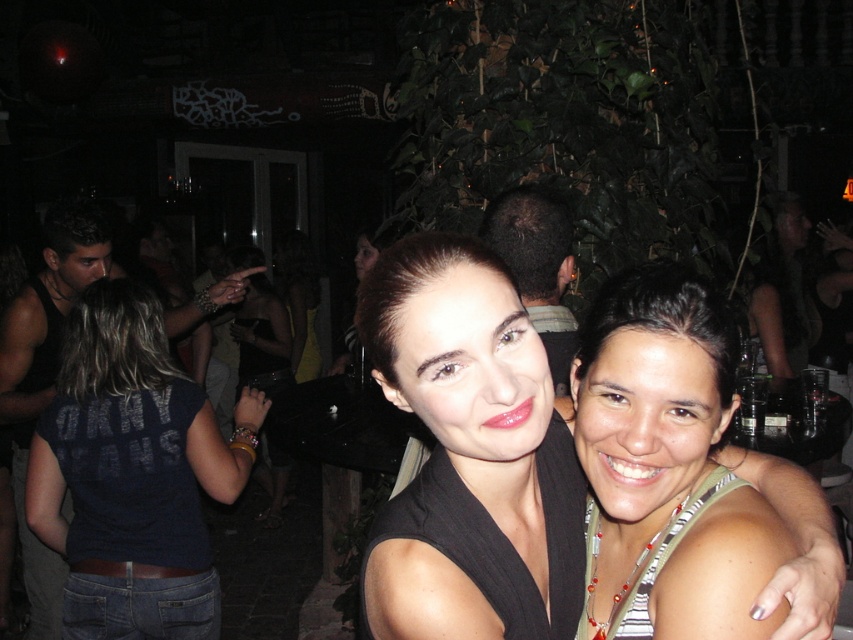
Looking at this image, is matte black top at center shorter than denim jeans at lower left?

Yes, matte black top at center is shorter than denim jeans at lower left.

Is matte black top at center below denim jeans at lower left?

Actually, matte black top at center is above denim jeans at lower left.

Find the location of a particular element. matte black top at center is located at coordinates (468, 456).

Who is higher up, matte black top at center or green striped tank top at center?

matte black top at center

Looking at this image, who is positioned more to the right, matte black top at center or green striped tank top at center?

Positioned to the right is green striped tank top at center.

At what (x,y) coordinates should I click in order to perform the action: click on matte black top at center. Please return your answer as a coordinate pair (x, y). Image resolution: width=853 pixels, height=640 pixels. Looking at the image, I should click on (468, 456).

I want to click on matte black top at center, so tap(468, 456).

Does green striped tank top at center have a lesser width compared to denim jeans at lower left?

Correct, green striped tank top at center's width is less than denim jeans at lower left's.

Can you confirm if green striped tank top at center is taller than denim jeans at lower left?

No.

Where is `green striped tank top at center`? The width and height of the screenshot is (853, 640). green striped tank top at center is located at coordinates (665, 464).